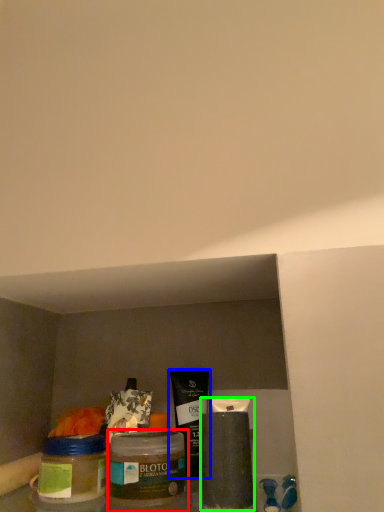
Question: Which is farther away from glass jar (highlighted by a red box)? product (highlighted by a blue box) or cleaning product (highlighted by a green box)?

Choices:
 (A) product
 (B) cleaning product

Answer: (A)